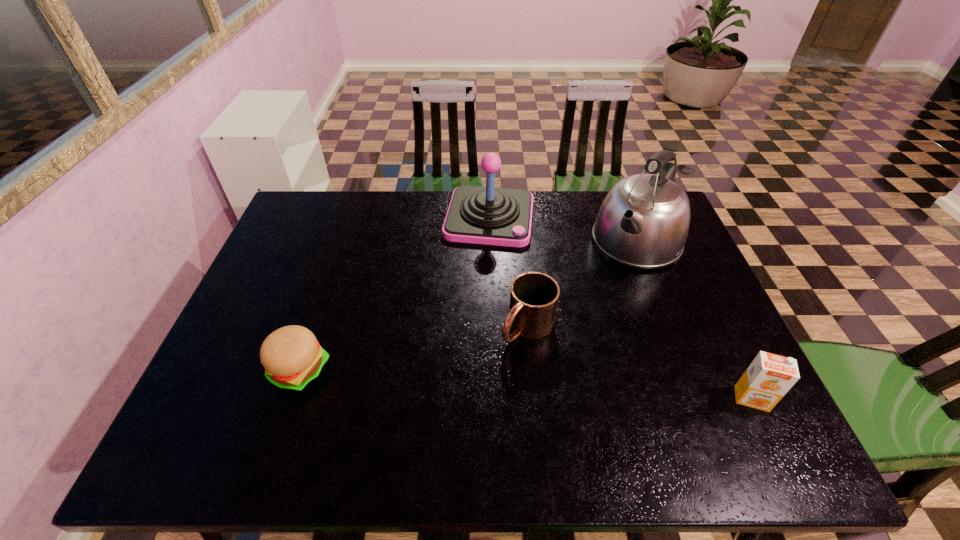
I want to click on vacant area at the far left corner, so click(314, 204).

The image size is (960, 540). I want to click on vacant area between the orange juice and the joystick, so click(621, 308).

At what (x,y) coordinates should I click in order to perform the action: click on vacant region between the mug and the fourth shortest object. Please return your answer as a coordinate pair (x, y). This screenshot has height=540, width=960. Looking at the image, I should click on (509, 272).

At what (x,y) coordinates should I click in order to perform the action: click on free space between the second tallest object and the hamburger. Please return your answer as a coordinate pair (x, y). The width and height of the screenshot is (960, 540). Looking at the image, I should click on (395, 294).

The height and width of the screenshot is (540, 960). I want to click on free point between the mug and the tallest object, so click(x=582, y=284).

I want to click on free space that is in between the mug and the second tallest object, so click(x=509, y=272).

Where is `free spot between the mug and the orange juice`? free spot between the mug and the orange juice is located at coordinates (639, 362).

You are a GUI agent. You are given a task and a screenshot of the screen. Output one action in this format:
    pyautogui.click(x=<x>, y=<y>)
    Task: Click on the vacant region between the kettle and the second tallest object
    Image resolution: width=960 pixels, height=540 pixels.
    Given the screenshot: What is the action you would take?
    pyautogui.click(x=564, y=230)

Image resolution: width=960 pixels, height=540 pixels. In order to click on vacant area that lies between the leftmost object and the orange juice in this screenshot , I will do `click(526, 385)`.

This screenshot has width=960, height=540. Find the location of `vacant area that lies between the joystick and the kettle`. vacant area that lies between the joystick and the kettle is located at coordinates (564, 230).